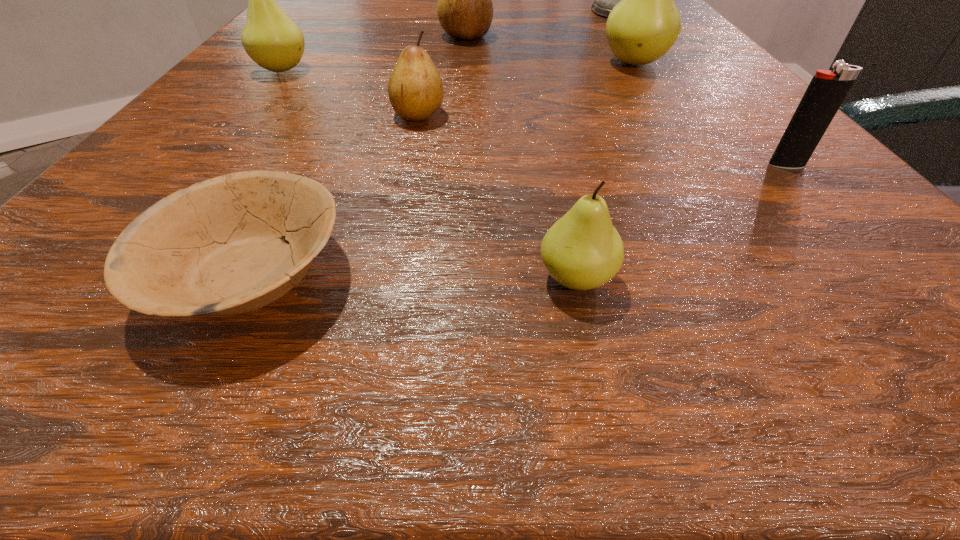
The height and width of the screenshot is (540, 960). I want to click on aerosol can, so click(x=604, y=0).

What are the coordinates of `the farthest object` in the screenshot? It's located at (604, 0).

Find the location of a particular element. The width and height of the screenshot is (960, 540). the rightmost pear is located at coordinates (644, 25).

The height and width of the screenshot is (540, 960). Find the location of `the tallest pear`. the tallest pear is located at coordinates (644, 25).

Locate an element on the screen. This screenshot has height=540, width=960. the bigger brown pear is located at coordinates (465, 11).

Locate an element on the screen. The image size is (960, 540). the farthest pear is located at coordinates (465, 11).

Locate an element on the screen. the leftmost green pear is located at coordinates (271, 39).

In order to click on the second smallest green pear in this screenshot , I will do `click(271, 39)`.

You are a GUI agent. You are given a task and a screenshot of the screen. Output one action in this format:
    pyautogui.click(x=<x>, y=<y>)
    Task: Click on the igniter
    Image resolution: width=960 pixels, height=540 pixels.
    Given the screenshot: What is the action you would take?
    pyautogui.click(x=827, y=90)

Locate an element on the screen. The width and height of the screenshot is (960, 540). the third nearest object is located at coordinates (827, 90).